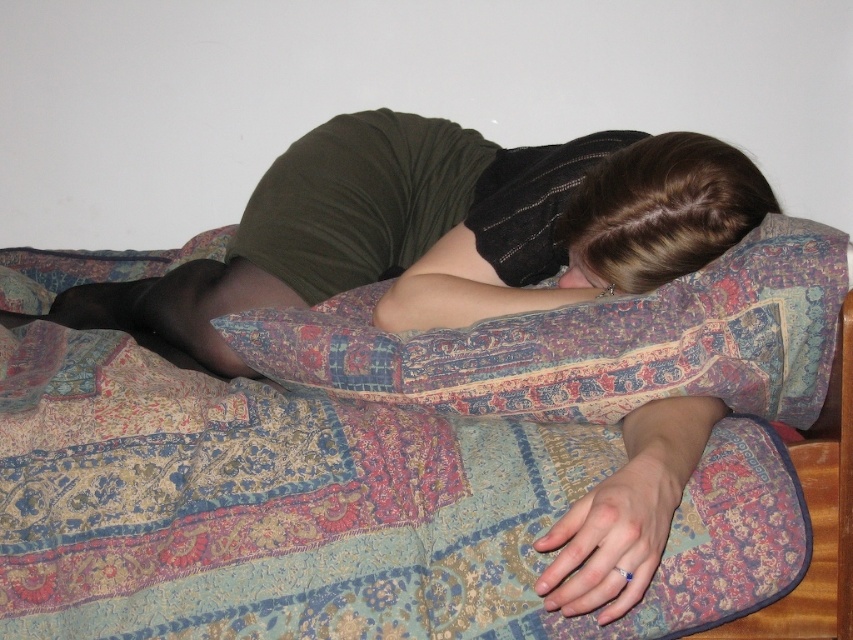
Measure the distance between point (183, 372) and camera.

Point (183, 372) is 3.34 feet away from camera.

Who is positioned more to the right, patterned fabric blanket at center or brown hair at upper center?

brown hair at upper center

Is point (267, 394) positioned in front of point (605, 227)?

That is True.

The image size is (853, 640). In order to click on patterned fabric blanket at center in this screenshot , I will do `click(367, 486)`.

Does point (368, 508) come behind point (264, 289)?

No, (368, 508) is in front of (264, 289).

Can you confirm if patterned fabric blanket at center is bigger than matte green shirt at center?

No, patterned fabric blanket at center is not bigger than matte green shirt at center.

Is point (515, 611) in front of point (352, 282)?

Yes, it is in front of point (352, 282).

Find the location of a particular element. patterned fabric blanket at center is located at coordinates (367, 486).

Does matte green shirt at center appear over brown hair at upper center?

Incorrect, matte green shirt at center is not positioned above brown hair at upper center.

Consider the image. Who is more distant from viewer, (x=509, y=305) or (x=622, y=218)?

The point (x=509, y=305) is more distant.

Where is `matte green shirt at center`? This screenshot has width=853, height=640. matte green shirt at center is located at coordinates (445, 228).